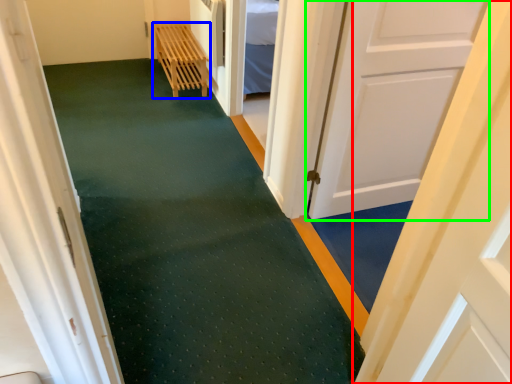
Question: Which is farther away from door (highlighted by a red box)? furniture (highlighted by a blue box) or door (highlighted by a green box)?

Choices:
 (A) furniture
 (B) door

Answer: (A)